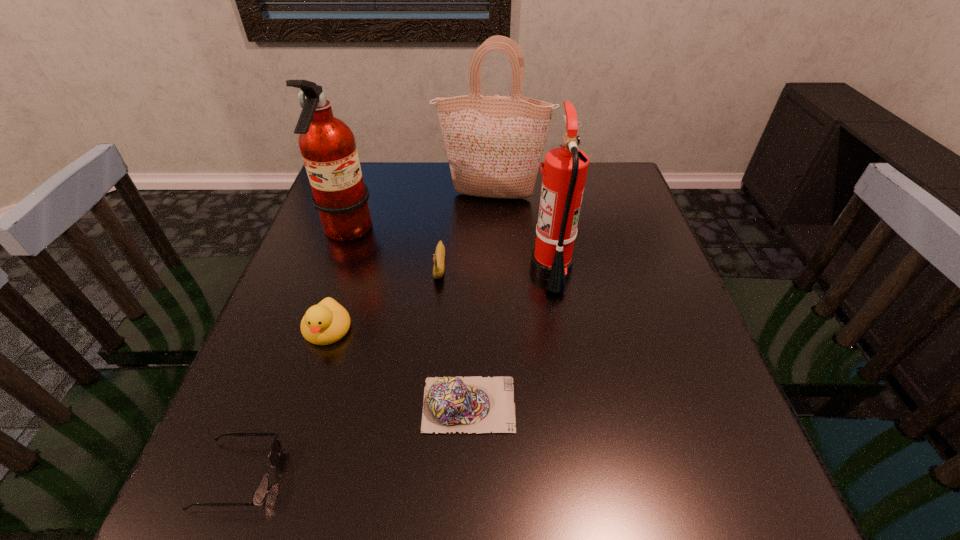
The width and height of the screenshot is (960, 540). Identify the location of free space that satisfies the following two spatial constraints: 1. on the face of the third nearest object; 2. at the front lenses of the sunglasses. (280, 476).

The width and height of the screenshot is (960, 540). Identify the location of free space that satisfies the following two spatial constraints: 1. at the nozzle of the right fire extinguisher; 2. on the face of the fifth farthest object. (562, 329).